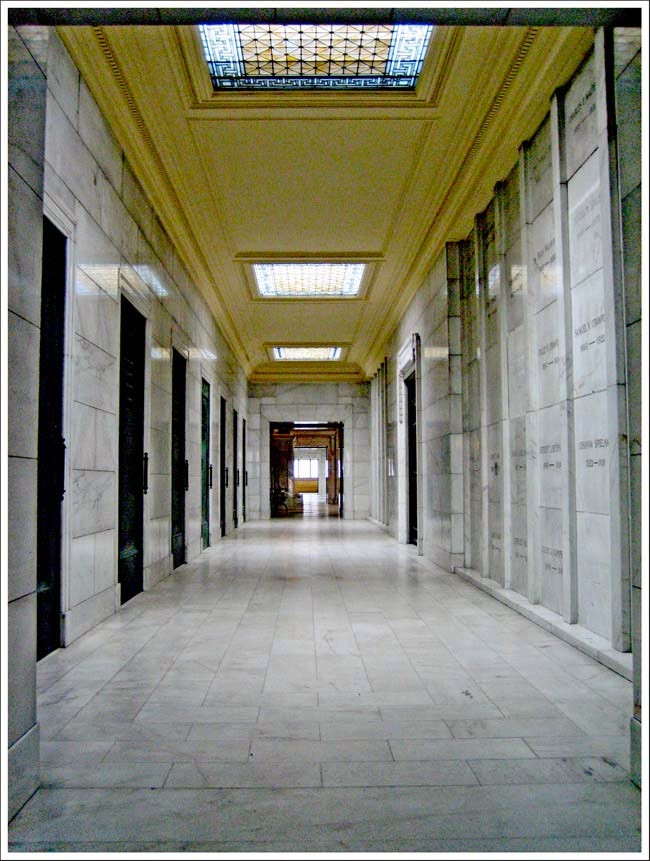
At what (x,y) coordinates should I click in order to perform the action: click on roof windows. Please return your answer as a coordinate pair (x, y). The height and width of the screenshot is (861, 650). Looking at the image, I should click on (329, 274), (309, 344).